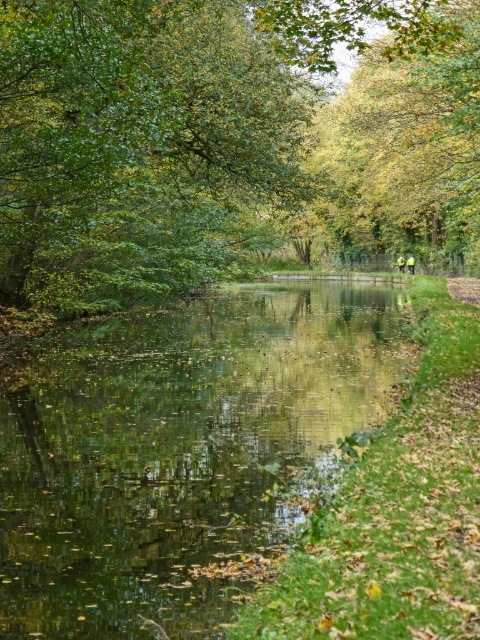
Question: Does green leafy tree at center have a smaller size compared to green reflective water at center?

Choices:
 (A) yes
 (B) no

Answer: (B)

Question: Is green leafy tree at center behind green reflective water at center?

Choices:
 (A) no
 (B) yes

Answer: (B)

Question: Which object is farther from the camera taking this photo?

Choices:
 (A) green reflective water at center
 (B) green leafy tree at center

Answer: (B)

Question: Where is green leafy tree at center located in relation to green reflective water at center in the image?

Choices:
 (A) right
 (B) left

Answer: (A)